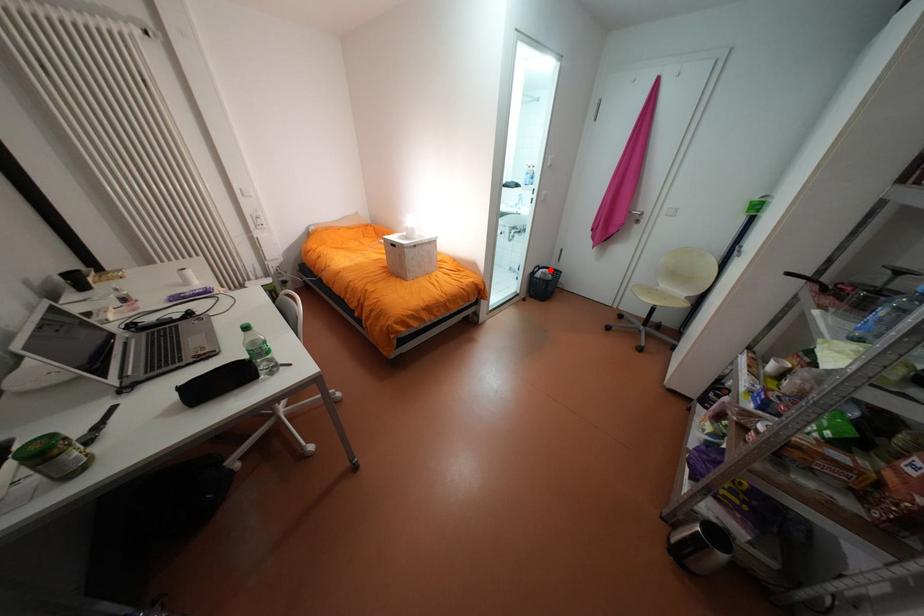
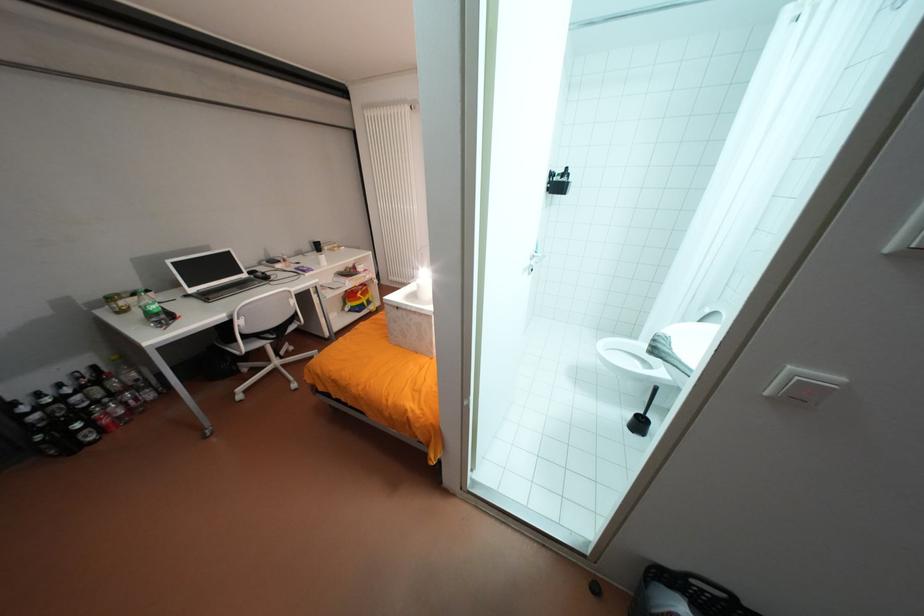
The point at the highlighted location is marked in the first image. Where is the corresponding point in the second image?

(694, 609)